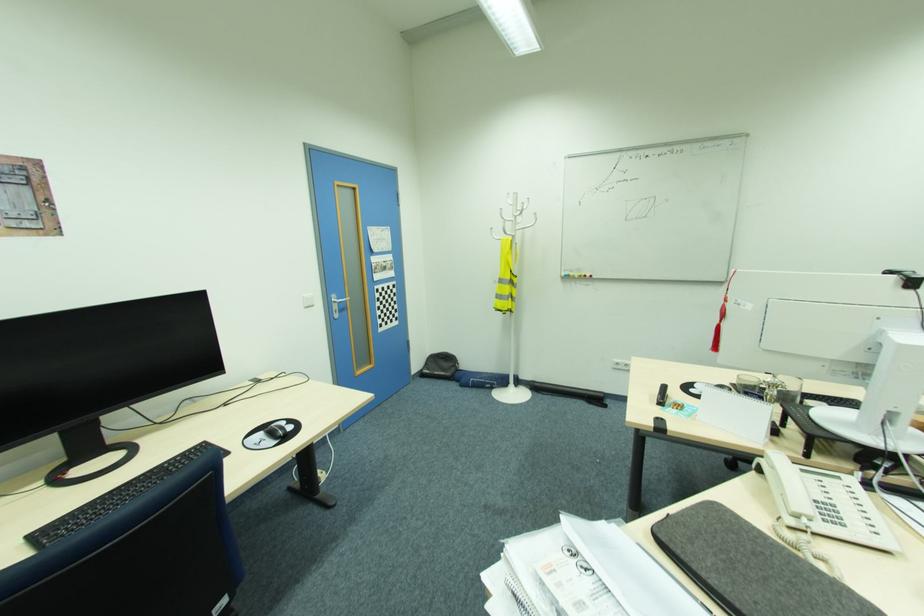
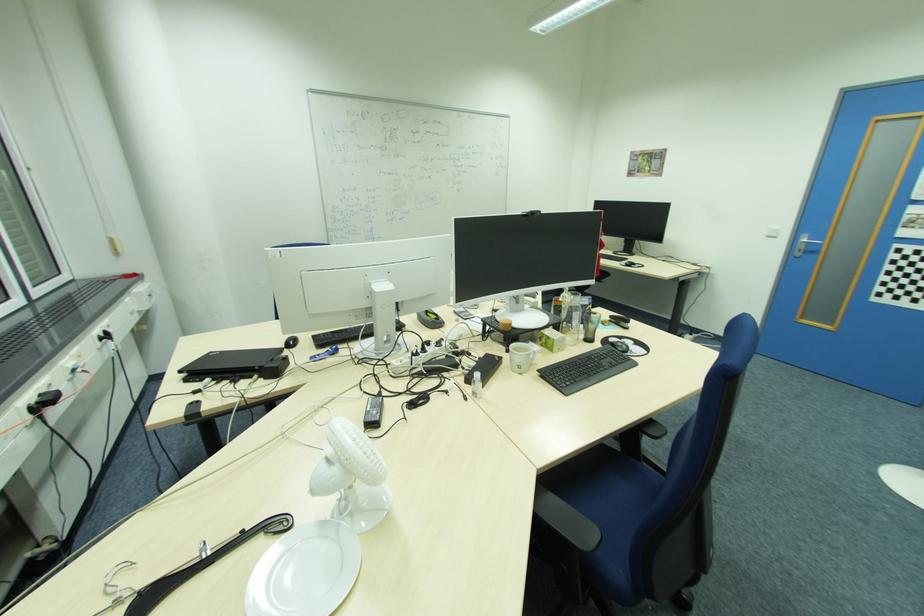
Find the pixel in the second image that matches pixel 338 310 in the first image.

(804, 251)